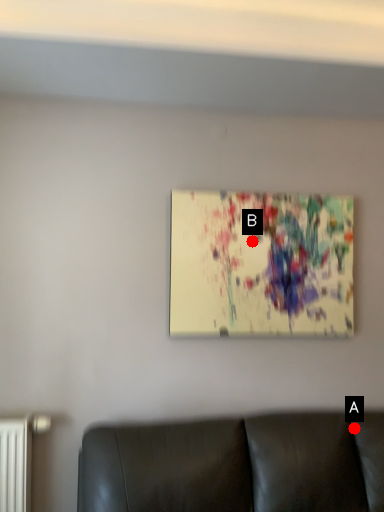
Question: Two points are circled on the image, labeled by A and B beside each circle. Which point is farther to the camera?

Choices:
 (A) A is further
 (B) B is further

Answer: (B)